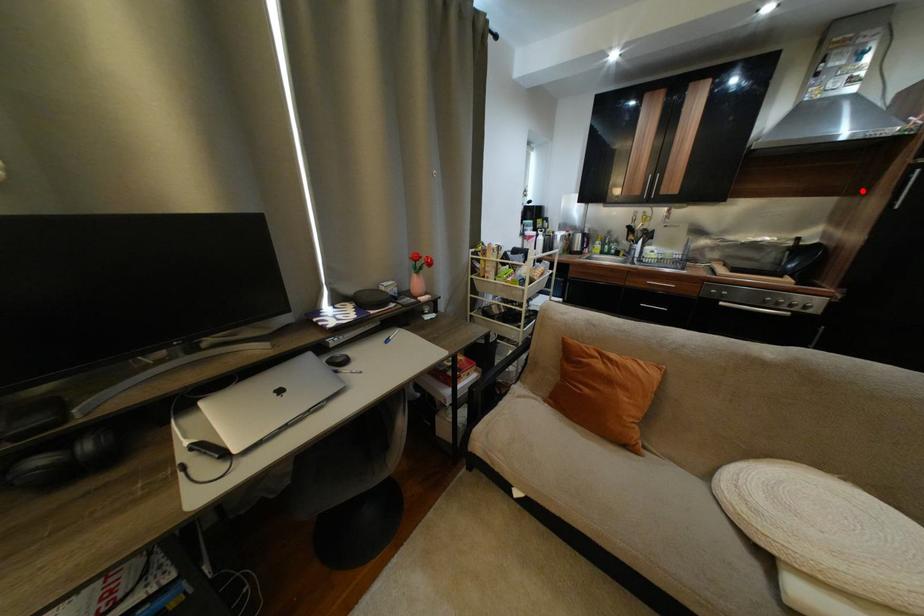
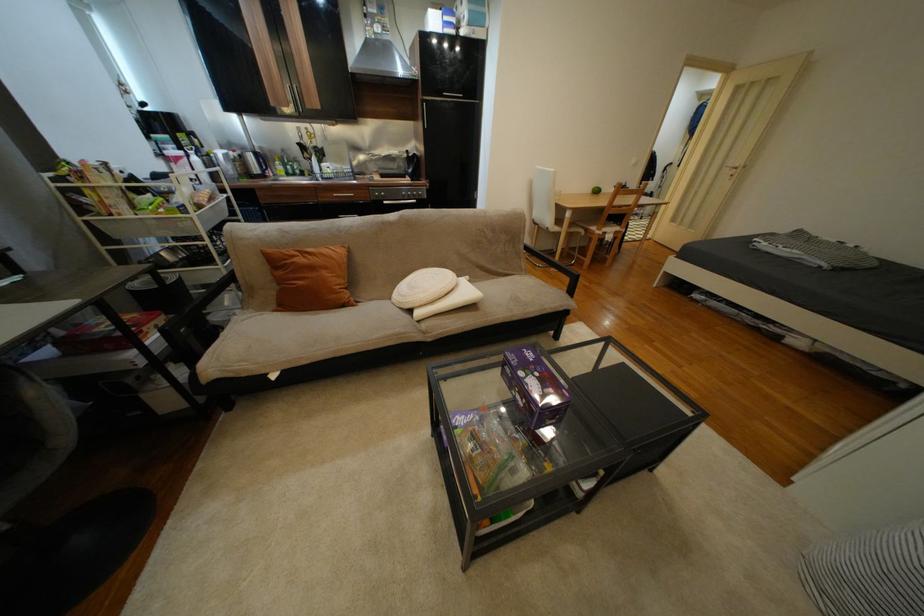
The point at the highlighted location is marked in the first image. Where is the corresponding point in the second image?

(422, 118)